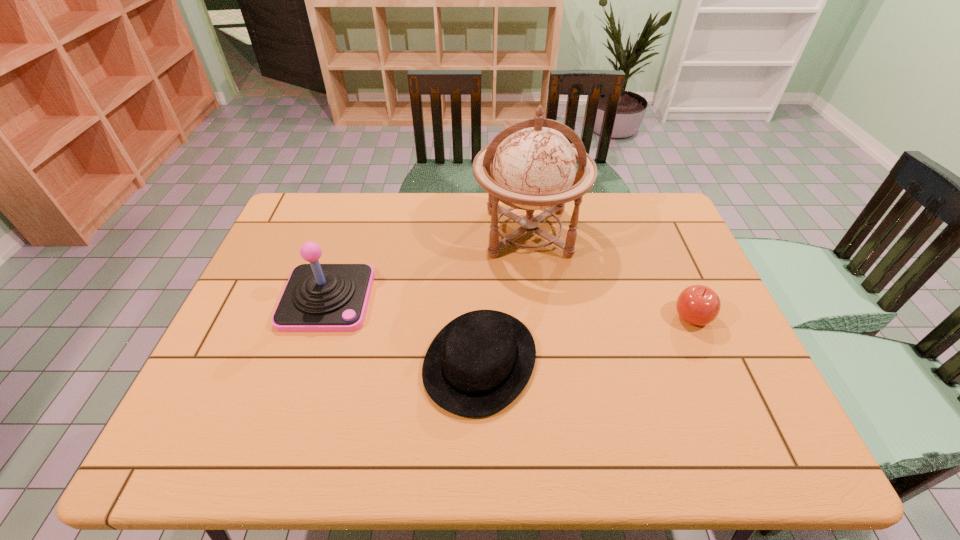
Find the location of a particular element. The height and width of the screenshot is (540, 960). the tallest object is located at coordinates (533, 166).

The width and height of the screenshot is (960, 540). I want to click on joystick, so click(318, 297).

Identify the location of the leftmost object. The height and width of the screenshot is (540, 960). (318, 297).

I want to click on the third tallest object, so click(x=699, y=305).

The width and height of the screenshot is (960, 540). I want to click on the rightmost object, so click(x=699, y=305).

Where is `fedora`? This screenshot has height=540, width=960. fedora is located at coordinates tap(479, 363).

This screenshot has height=540, width=960. I want to click on vacant space positioned 0.260m at the front of the globe showing Africa, so click(541, 342).

Identify the location of vacant region located forward from the base of the second tallest object. (280, 441).

This screenshot has height=540, width=960. Find the location of `free space located 0.190m on the back of the second shortest object`. free space located 0.190m on the back of the second shortest object is located at coordinates (665, 256).

This screenshot has height=540, width=960. In order to click on vacant area situated 0.260m on the left of the fedora in this screenshot , I will do `click(317, 361)`.